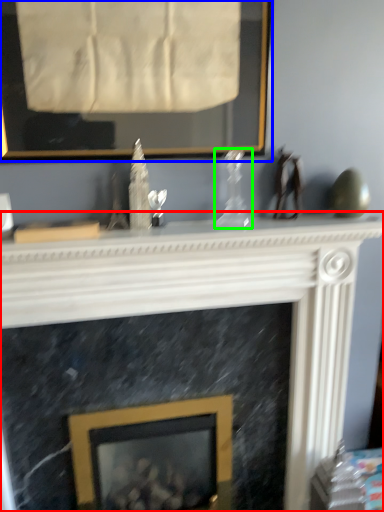
Question: Considering the real-world distances, which object is farthest from fireplace (highlighted by a red box)? picture frame (highlighted by a blue box) or glass vase (highlighted by a green box)?

Choices:
 (A) picture frame
 (B) glass vase

Answer: (A)